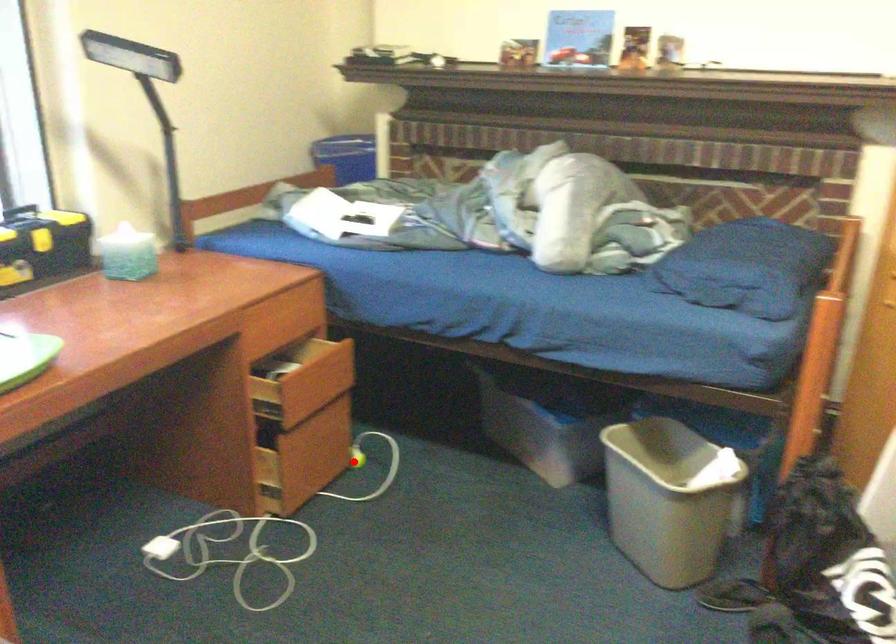
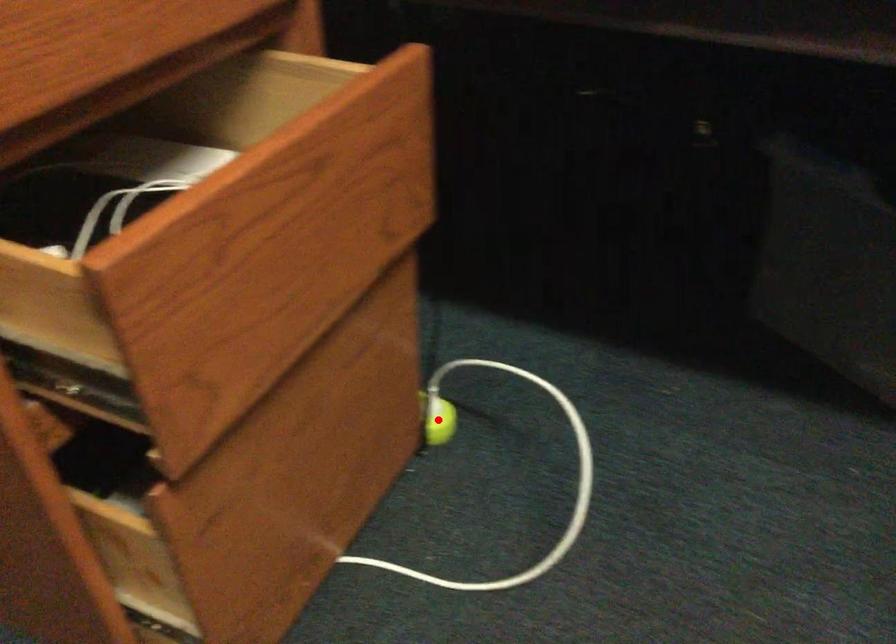
I am providing you with two images of the same scene from different viewpoints. A red point is marked on the first image and another point is marked on the second image. Is the red point in image1 aligned with the point shown in image2?

Yes